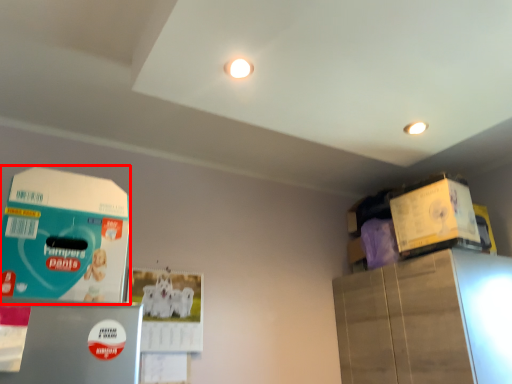
Question: From the image's perspective, what is the correct spatial relationship of box (annotated by the red box) in relation to box?

Choices:
 (A) below
 (B) above

Answer: (A)